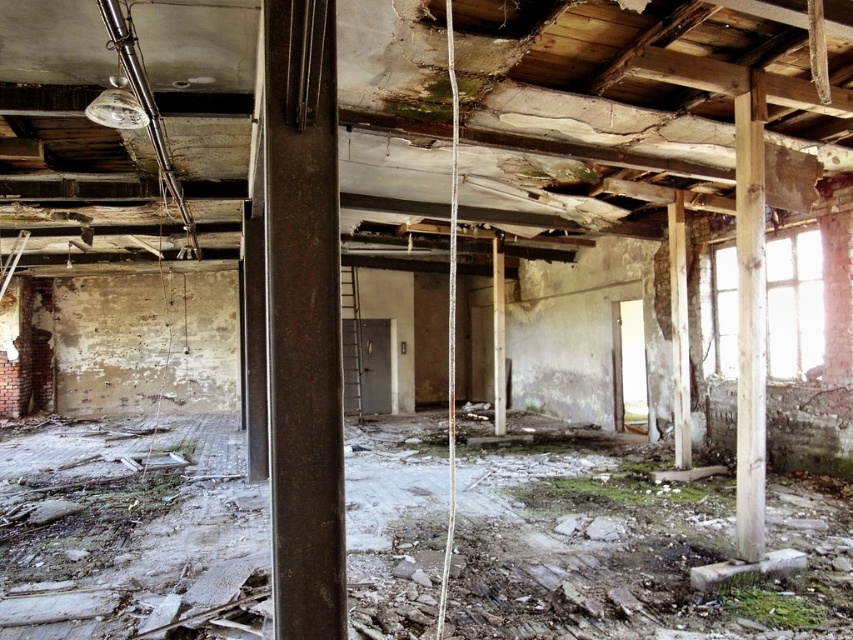
You are an inspector assessing the structural integrity of the building. You notice the wooden post at right and wooden beam at center. Which object is located above the other?

The wooden post at right is positioned over the wooden beam at center, so the wooden post at right is above the wooden beam at center.

You are standing in the dilapidated building and want to reach the point at coordinates (675, 259). If your walking speed is 1.5 meters per second, how many seconds will it take to reach that point?

The distance between you and the point at coordinates (675, 259) is 8.05 meters. At a walking speed of 1.5 meters per second, it will take approximately 5.37 seconds to reach the point.